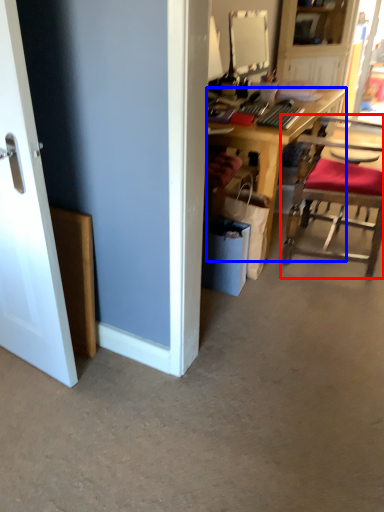
Question: Which object appears closest to the camera in this image, chair (highlighted by a red box) or desk (highlighted by a blue box)?

Choices:
 (A) chair
 (B) desk

Answer: (A)